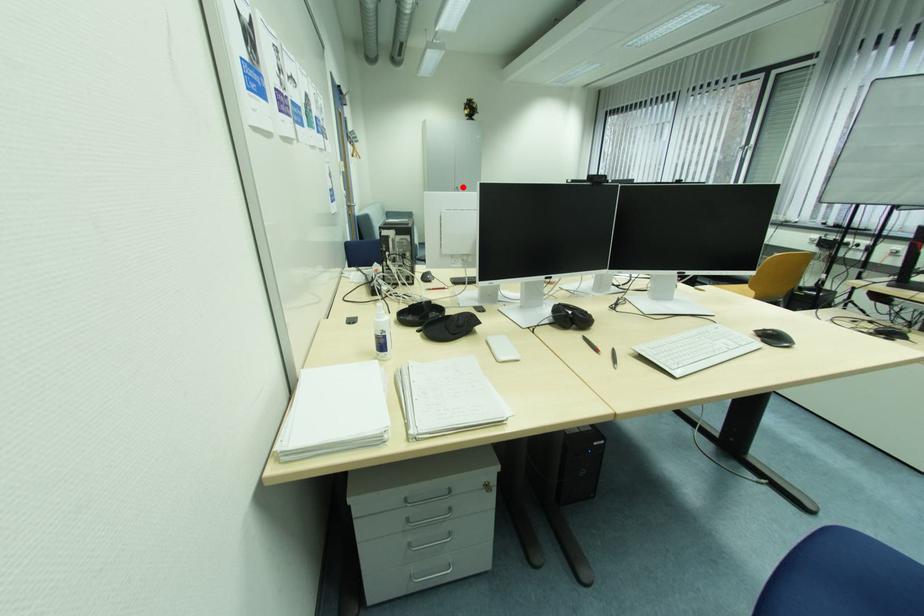
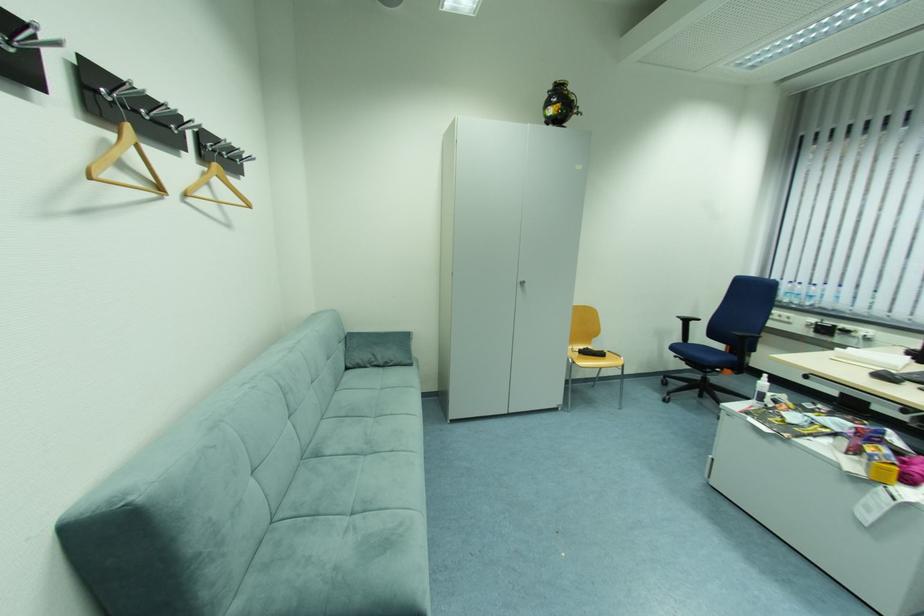
Question: I am providing you with two images of the same scene from different viewpoints. Image1 has a red point marked. In image2, the corresponding 3D location appears at what relative position? Reply with the corresponding letter.

Choices:
 (A) Closer
 (B) Farther

Answer: (A)